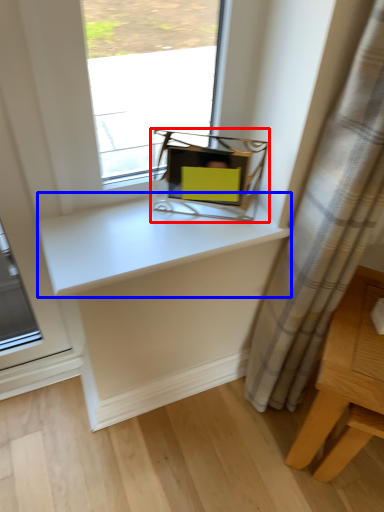
Question: Which of the following is the farthest to the observer, equipment (highlighted by a red box) or counter top (highlighted by a blue box)?

Choices:
 (A) equipment
 (B) counter top

Answer: (A)